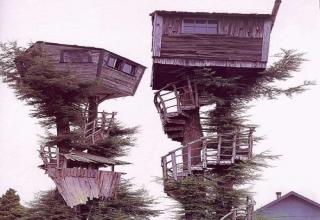
The width and height of the screenshot is (320, 220). What are the coordinates of `staircase` in the screenshot? It's located at (90, 137), (202, 155).